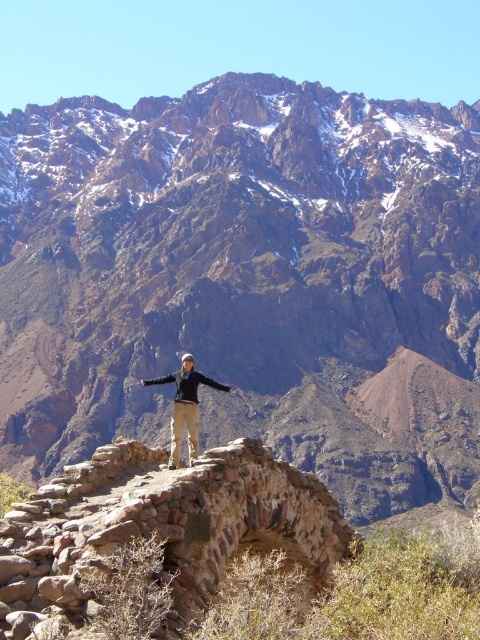
Who is positioned more to the right, brown rocky mountain range at upper center or khaki pants at center?

brown rocky mountain range at upper center is more to the right.

Does brown rocky mountain range at upper center appear over khaki pants at center?

Correct, brown rocky mountain range at upper center is located above khaki pants at center.

Does point (250, 376) lie behind point (190, 385)?

Yes, point (250, 376) is behind point (190, 385).

The image size is (480, 640). Identify the location of brown rocky mountain range at upper center. (248, 280).